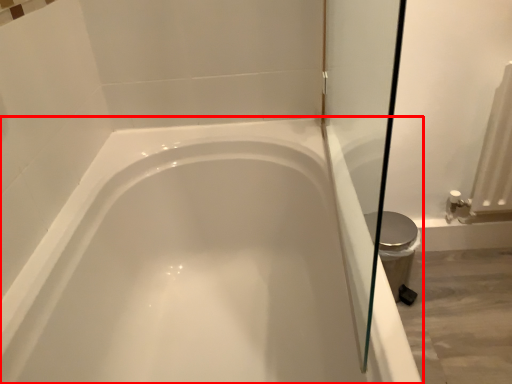
Question: Considering the relative positions of bathtub (annotated by the red box) and bidet in the image provided, where is bathtub (annotated by the red box) located with respect to the staircase?

Choices:
 (A) right
 (B) left

Answer: (B)